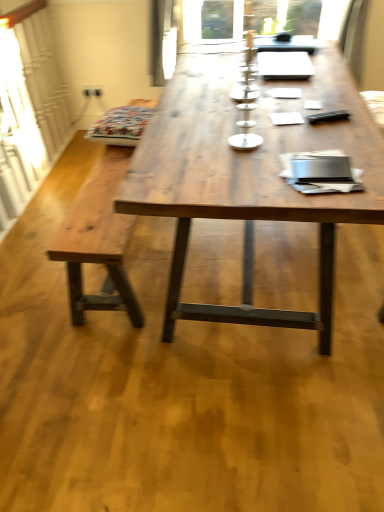
Question: Would you say patterned fabric cushion at left is inside or outside wooden table at center?

Choices:
 (A) outside
 (B) inside

Answer: (A)

Question: From a real-world perspective, is patterned fabric cushion at left above or below wooden table at center?

Choices:
 (A) below
 (B) above

Answer: (B)

Question: Which object is the closest to the patterned fabric cushion at left?

Choices:
 (A) wooden bench at left
 (B) wooden table at center

Answer: (A)

Question: Which of these objects is positioned closest to the wooden table at center?

Choices:
 (A) wooden bench at left
 (B) patterned fabric cushion at left

Answer: (A)